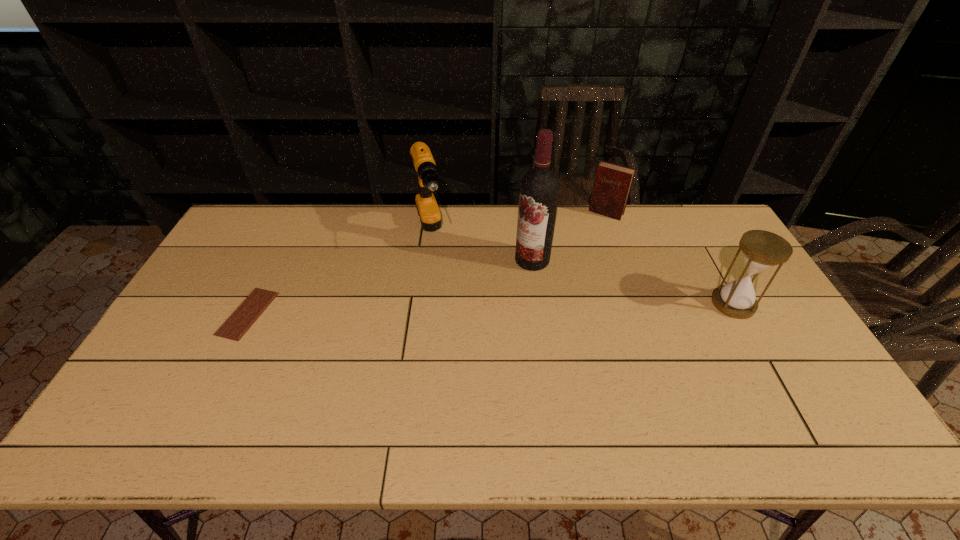
I want to click on free space located 0.380m on the front cover of the diary, so click(560, 284).

Where is `drill at the far edge`? The width and height of the screenshot is (960, 540). drill at the far edge is located at coordinates click(x=428, y=180).

Identify the location of diary that is positioned at the far edge. (612, 184).

You are a GUI agent. You are given a task and a screenshot of the screen. Output one action in this format:
    pyautogui.click(x=<x>, y=<y>)
    Task: Click on the object located at the left edge
    This screenshot has height=540, width=960.
    Given the screenshot: What is the action you would take?
    pyautogui.click(x=234, y=328)

You are a GUI agent. You are given a task and a screenshot of the screen. Output one action in this format:
    pyautogui.click(x=<x>, y=<y>)
    Task: Click on the object that is at the right edge
    The image size is (960, 540).
    Given the screenshot: What is the action you would take?
    pyautogui.click(x=761, y=250)

This screenshot has width=960, height=540. What are the coordinates of `vacant region at the far edge` in the screenshot? It's located at (664, 218).

In the image, there is a desktop. Where is `free region at the near edge`? This screenshot has height=540, width=960. free region at the near edge is located at coordinates (500, 396).

This screenshot has width=960, height=540. What are the coordinates of `vacant area at the left edge` in the screenshot? It's located at (217, 328).

You are a GUI agent. You are given a task and a screenshot of the screen. Output one action in this format:
    pyautogui.click(x=<x>, y=<y>)
    Task: Click on the vacant region at the near left corner
    Image resolution: width=960 pixels, height=540 pixels.
    Given the screenshot: What is the action you would take?
    pyautogui.click(x=198, y=383)

You are a GUI agent. You are given a task and a screenshot of the screen. Output one action in this format:
    pyautogui.click(x=<x>, y=<y>)
    Task: Click on the free location at the near right corner
    
    Given the screenshot: What is the action you would take?
    pyautogui.click(x=778, y=382)